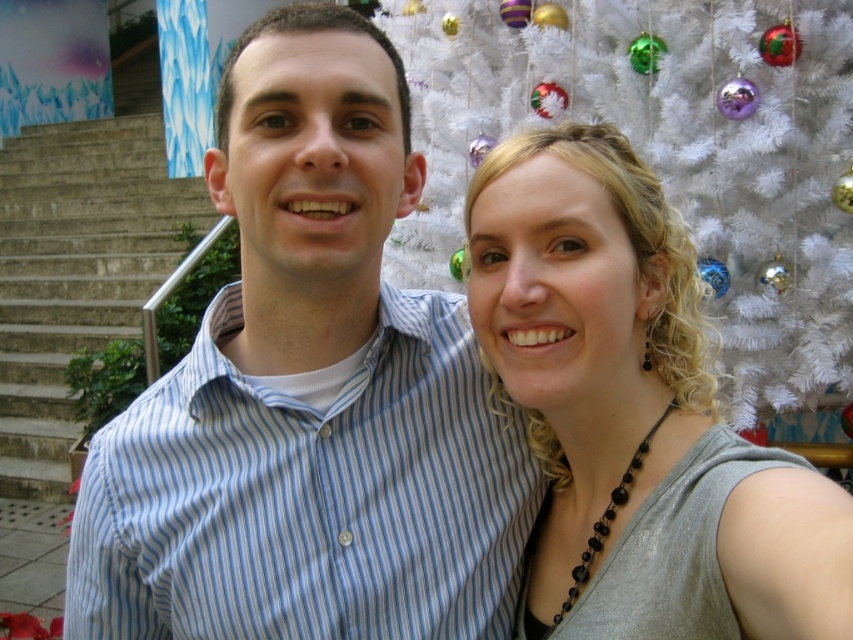
Is matte gray tank top at center positioned at the back of gray concrete stairs at left?

No, it is not.

Does matte gray tank top at center appear over gray concrete stairs at left?

No.

Between point (814, 624) and point (33, 156), which one is positioned in front?

Point (814, 624)

Image resolution: width=853 pixels, height=640 pixels. I want to click on matte gray tank top at center, so click(x=636, y=413).

I want to click on blue striped shirt at center, so click(308, 394).

Can you confirm if blue striped shirt at center is positioned below matte gray tank top at center?

Incorrect, blue striped shirt at center is not positioned below matte gray tank top at center.

Image resolution: width=853 pixels, height=640 pixels. I want to click on blue striped shirt at center, so [x=308, y=394].

What do you see at coordinates (666, 156) in the screenshot? The width and height of the screenshot is (853, 640). I see `white artificial christmas tree at upper right` at bounding box center [666, 156].

Does white artificial christmas tree at upper right appear under gray concrete stairs at left?

Indeed, white artificial christmas tree at upper right is positioned under gray concrete stairs at left.

At what (x,y) coordinates should I click in order to perform the action: click on white artificial christmas tree at upper right. Please return your answer as a coordinate pair (x, y). Looking at the image, I should click on (666, 156).

Find the location of a particular element. The image size is (853, 640). white artificial christmas tree at upper right is located at coordinates (666, 156).